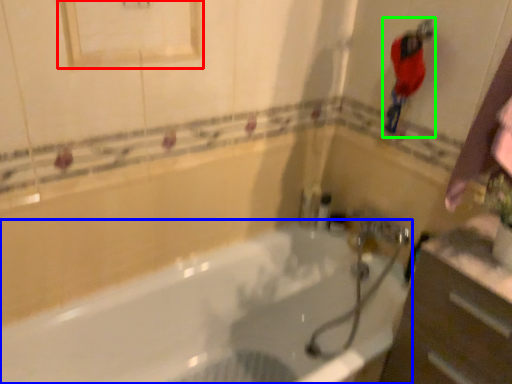
Question: Which object is the farthest from medicine cabinet (highlighted by a red box)? Choose among these: bathtub (highlighted by a blue box) or person (highlighted by a green box).

Choices:
 (A) bathtub
 (B) person

Answer: (A)